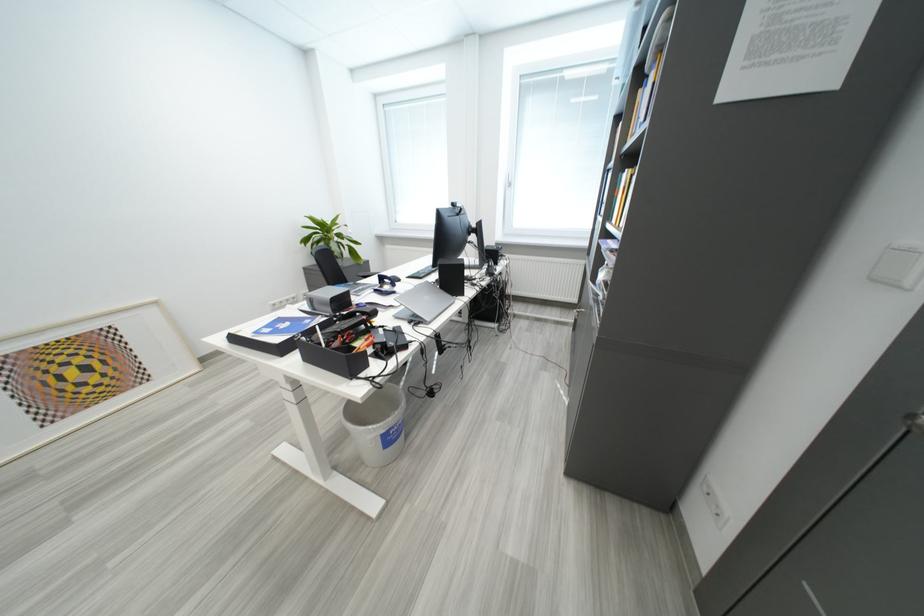
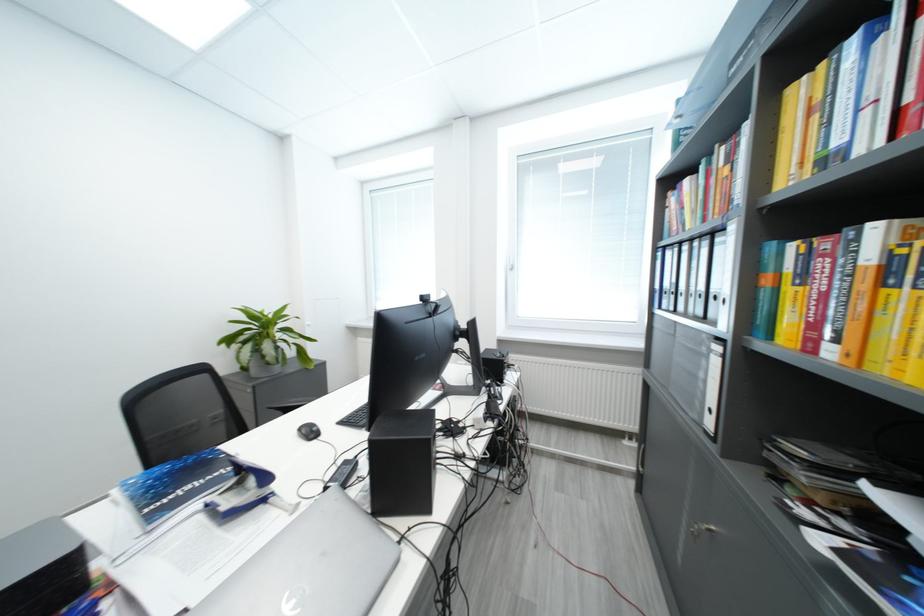
Question: In a continuous first-person perspective shot, in which direction is the camera moving?

Choices:
 (A) Left
 (B) Right
 (C) Forward
 (D) Backward

Answer: (C)